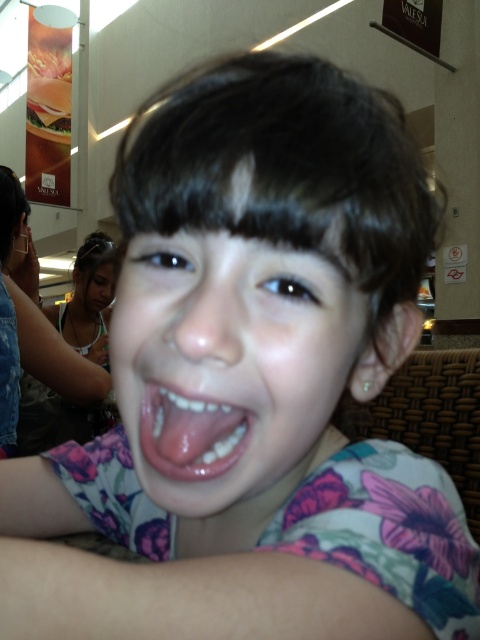
What do you see at coordinates (31, 323) in the screenshot? The width and height of the screenshot is (480, 640). I see `floral fabric shirt at center` at bounding box center [31, 323].

Which is more to the right, floral fabric shirt at center or pink glossy tongue at center?

pink glossy tongue at center is more to the right.

Is point (14, 196) behind point (204, 413)?

Yes, it is behind point (204, 413).

You are a GUI agent. You are given a task and a screenshot of the screen. Output one action in this format:
    pyautogui.click(x=<x>, y=<y>)
    Task: Click on the floral fabric shirt at center
    The height and width of the screenshot is (640, 480).
    Given the screenshot: What is the action you would take?
    pyautogui.click(x=31, y=323)

Find the location of a particular element. This screenshot has width=480, height=640. pink floral shirt at center is located at coordinates (228, 365).

Between pink floral shirt at center and matte skin face at upper left, which one is positioned lower?

pink floral shirt at center

Between point (236, 280) and point (101, 285), which one is positioned behind?

Positioned behind is point (101, 285).

Locate an element on the screen. This screenshot has width=480, height=640. pink floral shirt at center is located at coordinates (228, 365).

Which is behind, point (197, 403) or point (91, 289)?

Positioned behind is point (91, 289).

Find the location of a particular element. The width and height of the screenshot is (480, 640). pink glossy tongue at center is located at coordinates (190, 433).

Find the location of a particular element. Image resolution: width=480 pixels, height=640 pixels. pink glossy tongue at center is located at coordinates (190, 433).